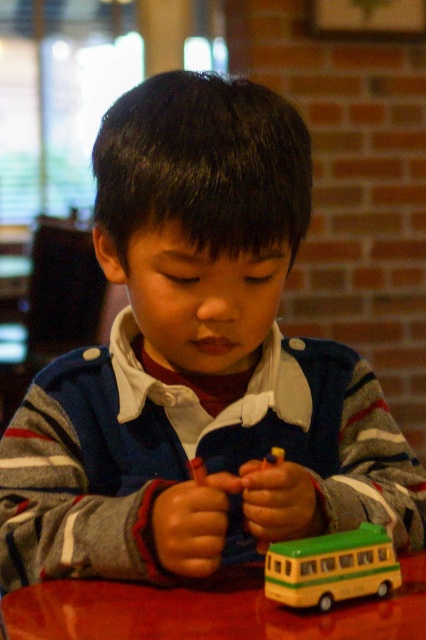
How much distance is there between shiny red table at lower center and yellow matte bus at lower center?

A distance of 3.07 inches exists between shiny red table at lower center and yellow matte bus at lower center.

Does shiny red table at lower center have a larger size compared to yellow matte bus at lower center?

Yes, shiny red table at lower center is bigger than yellow matte bus at lower center.

This screenshot has width=426, height=640. Describe the element at coordinates (207, 611) in the screenshot. I see `shiny red table at lower center` at that location.

You are a GUI agent. You are given a task and a screenshot of the screen. Output one action in this format:
    pyautogui.click(x=<x>, y=<y>)
    Task: Click on the shiny red table at lower center
    This screenshot has width=426, height=640.
    Given the screenshot: What is the action you would take?
    pyautogui.click(x=207, y=611)